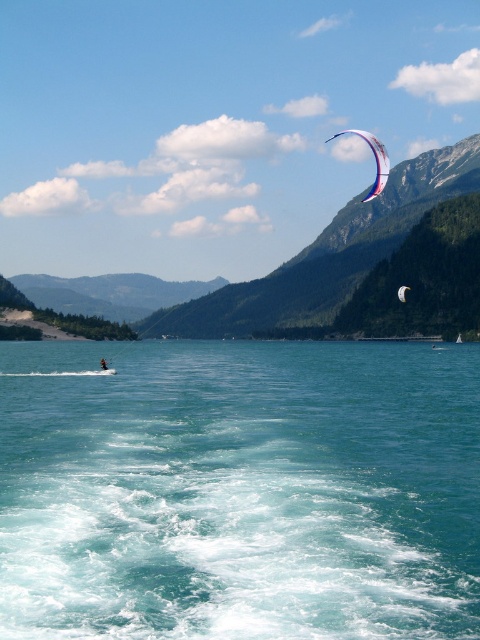
Question: Which point is closer to the camera?

Choices:
 (A) green forested mountain at upper center
 (B) clear blue water at lower center

Answer: (B)

Question: Is white and blue fabric parachute at upper right thinner than white mesh parachute at upper center?

Choices:
 (A) no
 (B) yes

Answer: (A)

Question: Among these points, which one is farthest from the camera?

Choices:
 (A) (405, 301)
 (B) (321, 547)
 (C) (322, 234)
 (D) (344, 131)

Answer: (D)

Question: Estimate the real-world distances between objects in this image. Which object is farther from the white kite at upper right?

Choices:
 (A) clear blue water at lower center
 (B) white and blue fabric parachute at upper right

Answer: (B)

Question: Can you confirm if clear blue water at lower center is thinner than white kite at upper right?

Choices:
 (A) yes
 (B) no

Answer: (B)

Question: Is white and blue fabric parachute at upper right positioned behind white kite at upper right?

Choices:
 (A) yes
 (B) no

Answer: (A)